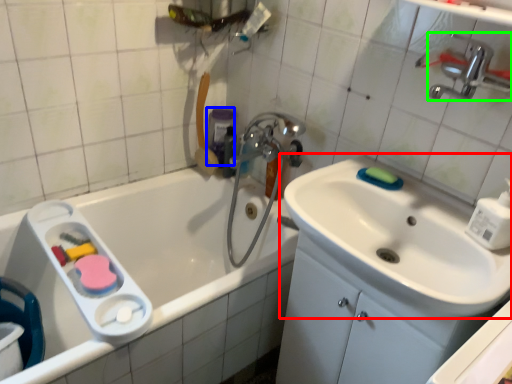
Question: Which is farther away from sink (highlighted by a red box)? mouthwash (highlighted by a blue box) or tap (highlighted by a green box)?

Choices:
 (A) mouthwash
 (B) tap

Answer: (A)